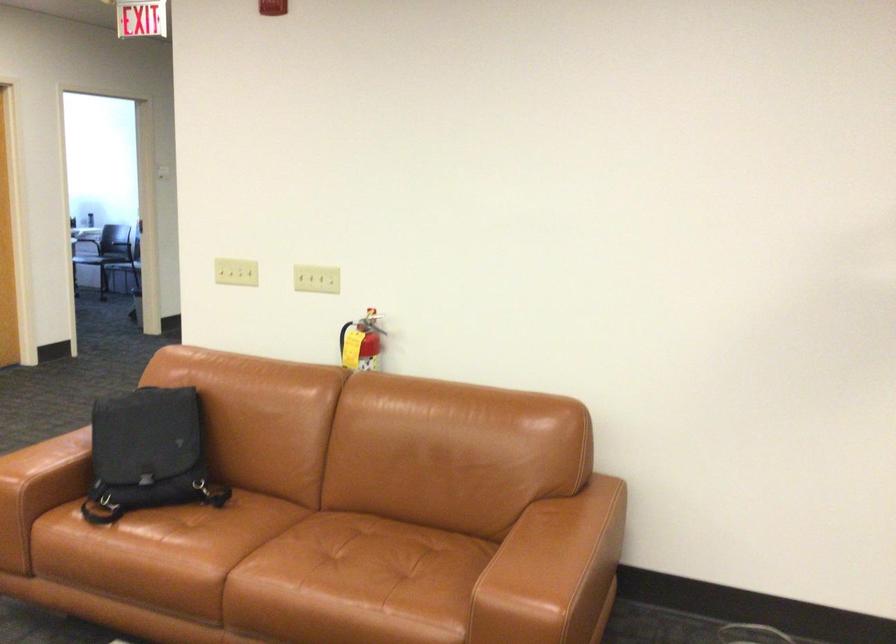
Where is `fire extinguisher handle`? The width and height of the screenshot is (896, 644). fire extinguisher handle is located at coordinates (371, 323).